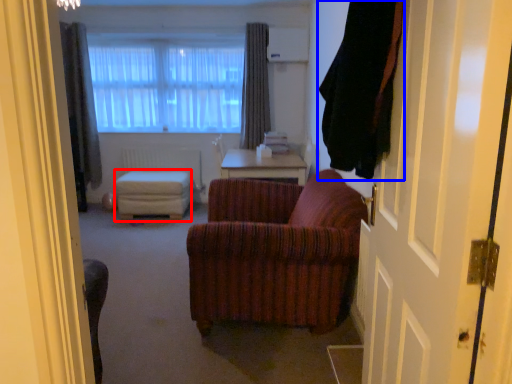
Question: Among these objects, which one is nearest to the camera, stool (highlighted by a red box) or curtain (highlighted by a blue box)?

Choices:
 (A) stool
 (B) curtain

Answer: (B)